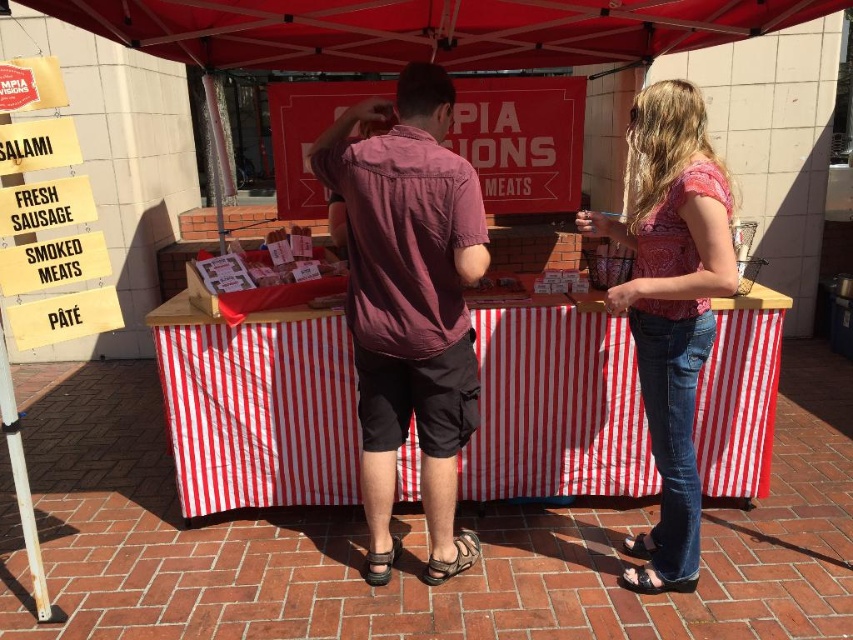
You are a customer at the food stall and want to find the smoked meats. The stall has a matte pink shirt at center and a red fabric canopy at upper center. Where would you look relative to these items?

The smoked meats are likely displayed on the wooden counter under the matte pink shirt at center, which is positioned below the red fabric canopy at upper center.

You are a customer at the food stall and want to choose between the matte pink shirt at center and the pink floral blouse at center. Which one is taller?

The matte pink shirt at center is taller than the pink floral blouse at center.

You are a customer at the food stall under the red canopy. You see a maroon cotton shirt at center. Where is the maroon cotton shirt located in relation to the wooden counter where the meat products are displayed?

The maroon cotton shirt at center is located at the center of the stall, which is on top of the wooden counter where the meat products are displayed.